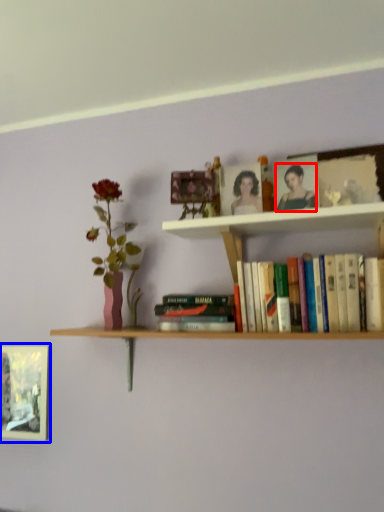
Question: Which object is further to the camera taking this photo, person (highlighted by a red box) or picture frame (highlighted by a blue box)?

Choices:
 (A) person
 (B) picture frame

Answer: (B)